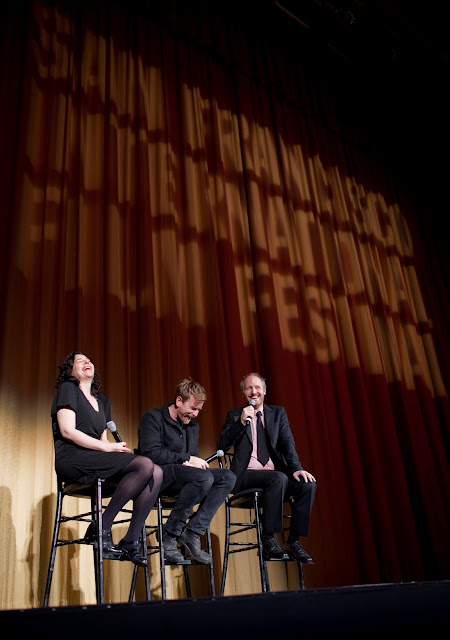
At what (x,y) coordinates should I click in order to perform the action: click on backdrop. Please return your answer as a coordinate pair (x, y). The width and height of the screenshot is (450, 640). Looking at the image, I should click on (95, 303), (369, 449).